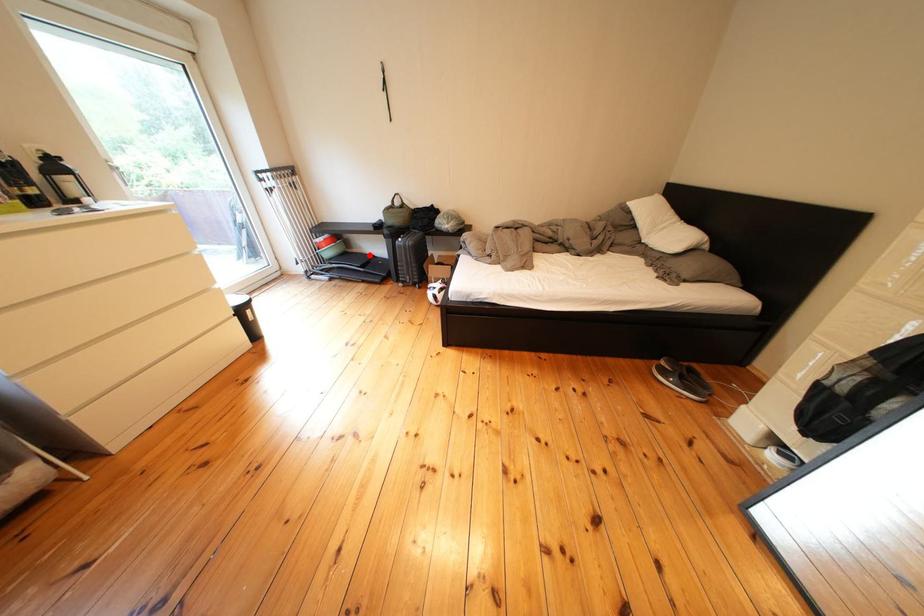
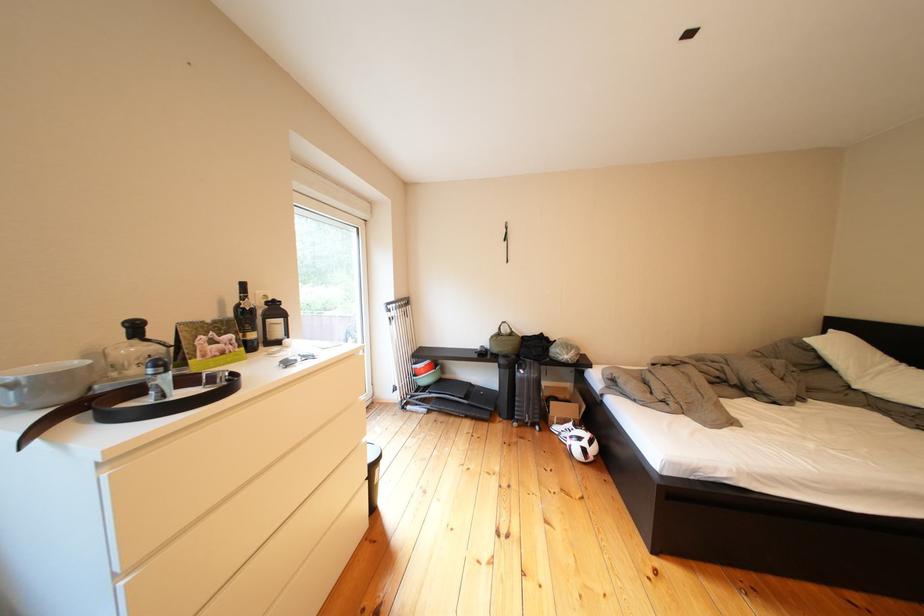
Question: I am providing you with two images of the same scene from different viewpoints. In image1, a red point is highlighted. Considering the same 3D point in image2, which of the following is correct?

Choices:
 (A) It is closer
 (B) It is farther

Answer: (B)